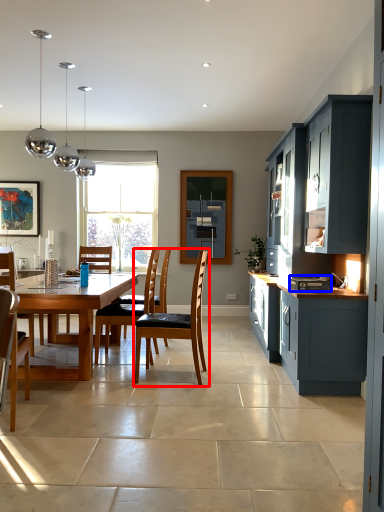
Question: Among these objects, which one is farthest to the camera, chair (highlighted by a red box) or appliance (highlighted by a blue box)?

Choices:
 (A) chair
 (B) appliance

Answer: (A)